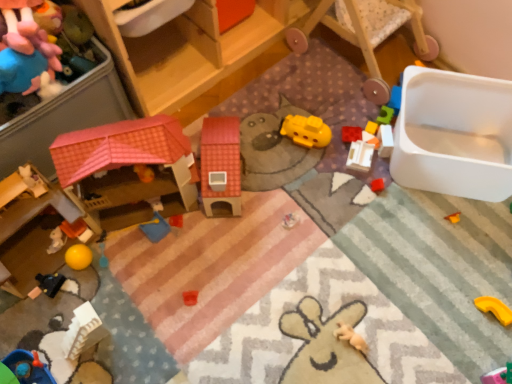
Where is `vacant area that lies between yellow matte block at upper right, the ninth toy when ordered from left to right, and black matte toy car at lower left, the tenth toy viewed from the right`? The image size is (512, 384). vacant area that lies between yellow matte block at upper right, the ninth toy when ordered from left to right, and black matte toy car at lower left, the tenth toy viewed from the right is located at coordinates coord(221,207).